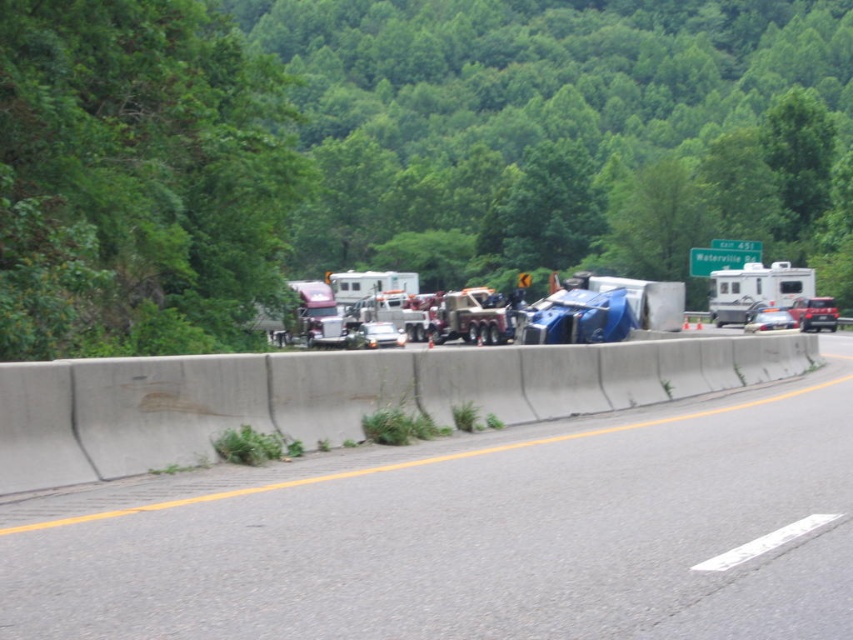
You are a driver approaching the highway scene. You see a white glossy rv at center. Can you confirm if the white glossy rv at center is exactly at the coordinates point (755, 289)?

The white glossy rv at center is located at point (755, 289), so yes, it is exactly at those coordinates.

You are a drone operator trying to assess the accident scene. Your drone is currently 5 meters above the ground. The gray concrete barrier at center is an obstacle. Can your drone safely fly over it without hitting it?

The gray concrete barrier at center is 4.46 meters from camera. Since the drone is 5 meters above the ground, it can safely fly over the barrier as its height is sufficient to clear the barrier.

Looking at this image, you are a driver approaching the highway scene. You notice the gray concrete barrier at center and the metallic blue sedan at center. Which object is shorter in height?

The gray concrete barrier at center has a lesser height compared to the metallic blue sedan at center, so the gray concrete barrier at center is shorter.